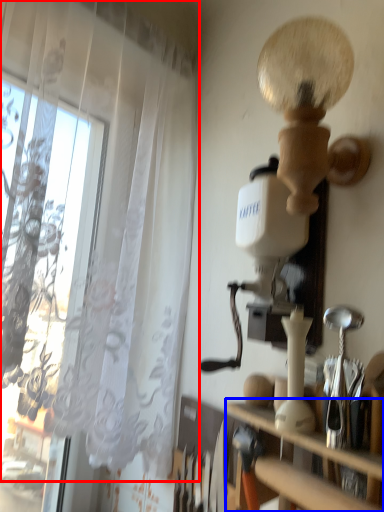
Question: Which object appears farthest to the camera in this image, curtain (highlighted by a red box) or shelf (highlighted by a blue box)?

Choices:
 (A) curtain
 (B) shelf

Answer: (A)